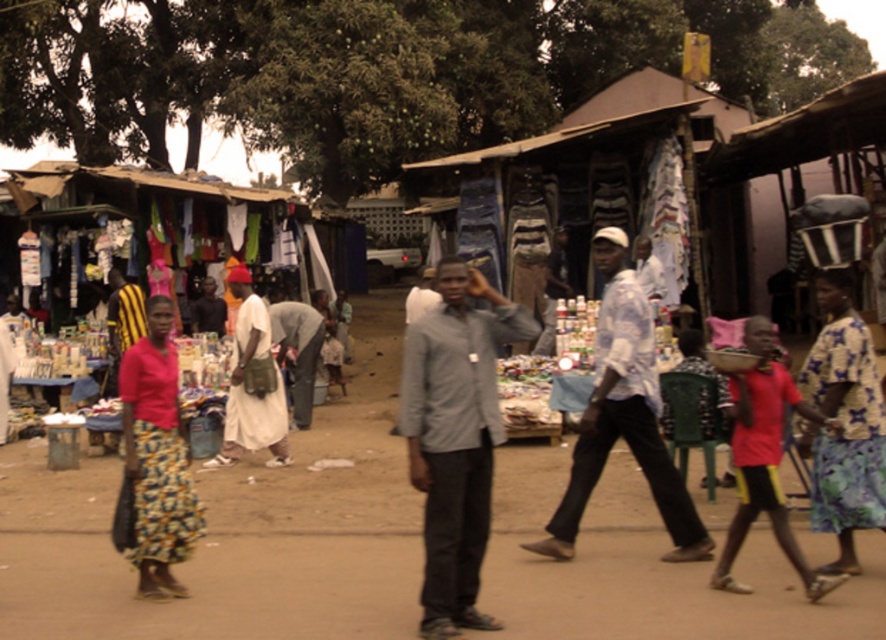
Can you confirm if printed fabric dress at lower right is taller than floral print skirt at left?

Correct, printed fabric dress at lower right is much taller as floral print skirt at left.

Is point (877, 508) positioned after point (176, 589)?

No.

At what (x,y) coordinates should I click in order to perform the action: click on printed fabric dress at lower right. Please return your answer as a coordinate pair (x, y). The image size is (886, 640). Looking at the image, I should click on (843, 422).

Does gray cotton shirt at center have a greater height compared to white cotton dress at center?

Correct, gray cotton shirt at center is much taller as white cotton dress at center.

Is gray cotton shirt at center positioned behind white cotton dress at center?

No, gray cotton shirt at center is closer to the viewer.

Is point (421, 365) closer to camera compared to point (203, 465)?

Yes, it is in front of point (203, 465).

Identify the location of gray cotton shirt at center. This screenshot has width=886, height=640. (455, 436).

Consider the image. Is light blue shirt at center bigger than floral print skirt at left?

Indeed, light blue shirt at center has a larger size compared to floral print skirt at left.

Between light blue shirt at center and floral print skirt at left, which one is positioned lower?

Positioned lower is floral print skirt at left.

Is point (615, 275) positioned after point (161, 458)?

Yes, point (615, 275) is behind point (161, 458).

Where is `light blue shirt at center`? The image size is (886, 640). light blue shirt at center is located at coordinates (623, 416).